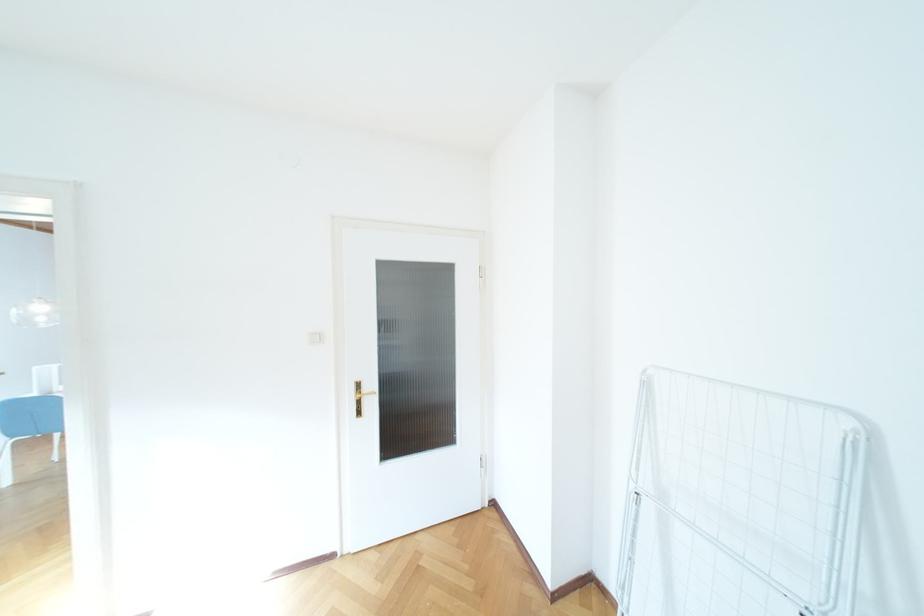
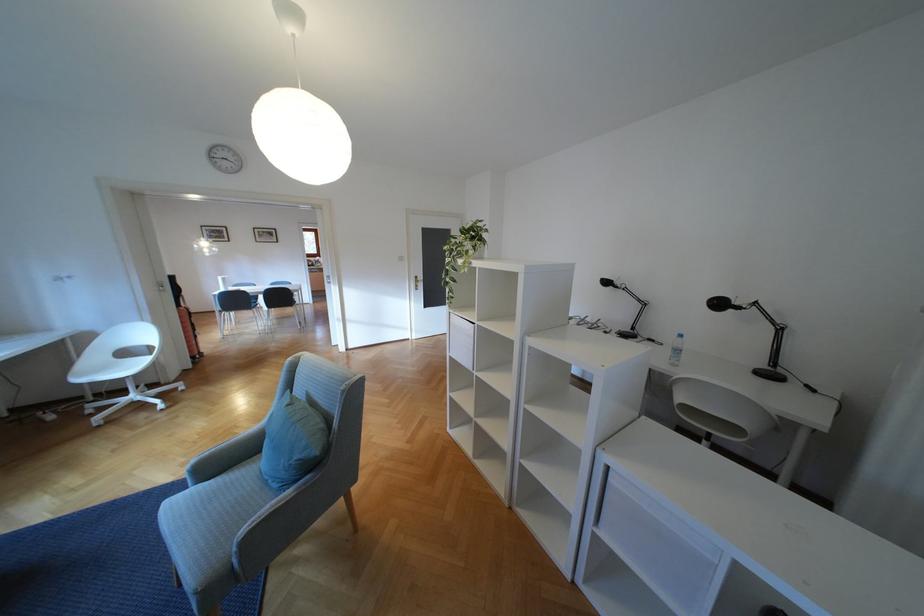
Question: Which direction would the cameraman need to move to produce the second image? Reply with the corresponding letter.

Choices:
 (A) Left
 (B) Right
 (C) Forward
 (D) Backward

Answer: (D)